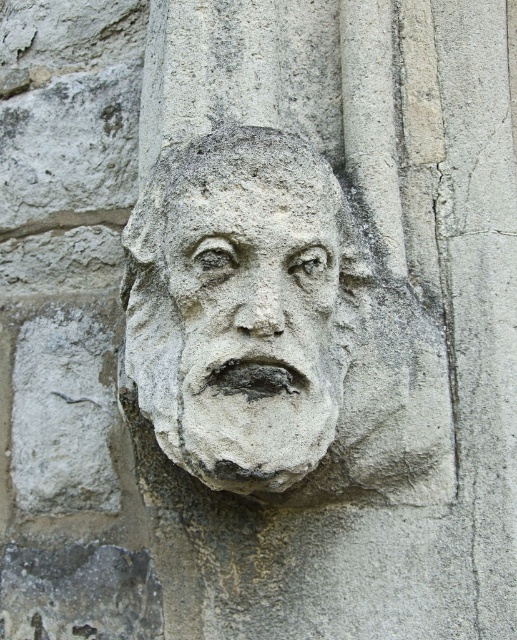
You are an architect inspecting a historical building. You notice two features on the wall in front of you. The first is the stone face at center, and the second is the stone textured face at center. Your measuring tool indicates they are 1.43 inches apart. If you need to place a protective barrier between them that must be at least 1.5 inches wide, will it fit without overlapping either feature?

The stone face at center and stone textured face at center are 1.43 inches apart. Since the required barrier width is 1.5 inches, which is wider than the space between them, the barrier cannot fit without overlapping one of the features.

You are an architect examining the stone gargoyle. You notice two features labeled as the stone face at center and the stone textured face at center. Which of these two features is larger in size?

The stone face at center is bigger than the stone textured face at center, so the stone face at center is larger in size.

You are an art conservator examining the stone gargoyle up close. You notice two specific points on the gargoyle, namely point (326, 324) and point (326, 394). Which of these two points is closer to your current position as you inspect the gargoyle?

Point (326, 324) is further to the viewer than point (326, 394). Therefore, point (326, 394) is closer to your current position.